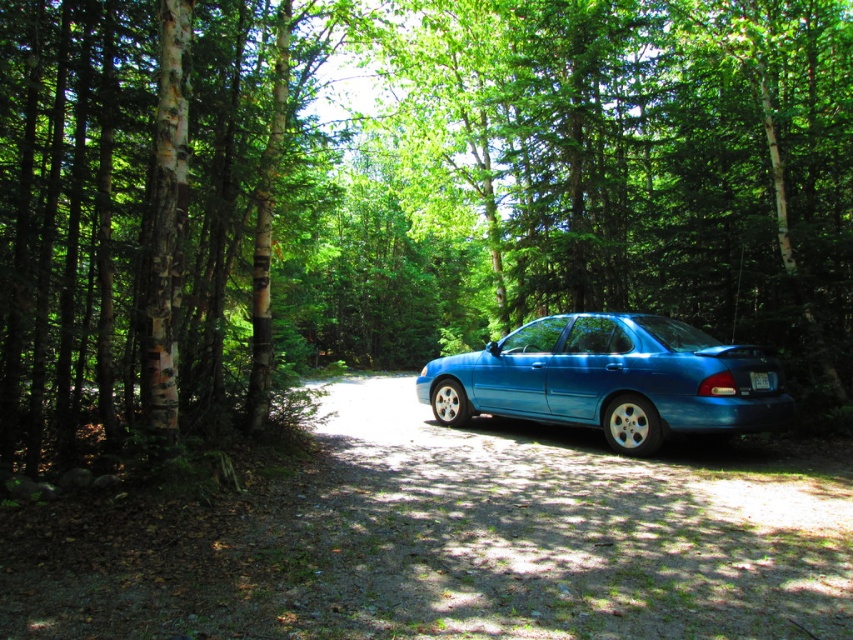
Which of these two, glossy blue sedan at center or white plastic license plate at rear, stands taller?

glossy blue sedan at center is taller.

Who is higher up, glossy blue sedan at center or white plastic license plate at rear?

white plastic license plate at rear

Measure the distance between point (x=445, y=406) and camera.

Point (x=445, y=406) and camera are 5.25 meters apart from each other.

You are a GUI agent. You are given a task and a screenshot of the screen. Output one action in this format:
    pyautogui.click(x=<x>, y=<y>)
    Task: Click on the glossy blue sedan at center
    
    Given the screenshot: What is the action you would take?
    pyautogui.click(x=608, y=380)